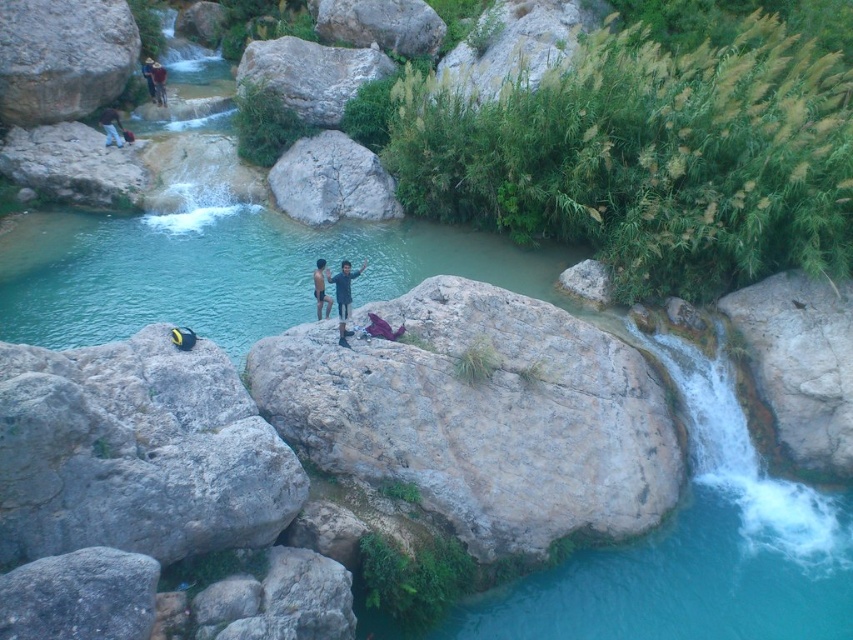
Is gray rough rock at center positioned at the back of gray rough boulder at upper center?

No, it is not.

Measure the distance between point (550, 497) and camera.

Point (550, 497) and camera are 52.56 feet apart from each other.

Where is `gray rough rock at center`? The height and width of the screenshot is (640, 853). gray rough rock at center is located at coordinates (483, 416).

Who is higher up, gray rock at center or dark blue shirt at upper left?

dark blue shirt at upper left is above.

Is gray rock at center thinner than dark blue shirt at upper left?

No.

Does point (299, 193) come closer to viewer compared to point (103, 124)?

Yes, it is.

This screenshot has width=853, height=640. Identify the location of gray rock at center. (331, 180).

Can you confirm if smooth gray rock at upper left is bigger than dark blue shirt at upper left?

No.

Between smooth gray rock at upper left and dark blue shirt at upper left, which one appears on the left side from the viewer's perspective?

Positioned to the left is smooth gray rock at upper left.

Is point (41, 45) closer to viewer compared to point (105, 108)?

Yes, point (41, 45) is closer to viewer.

I want to click on smooth gray rock at upper left, so 62,58.